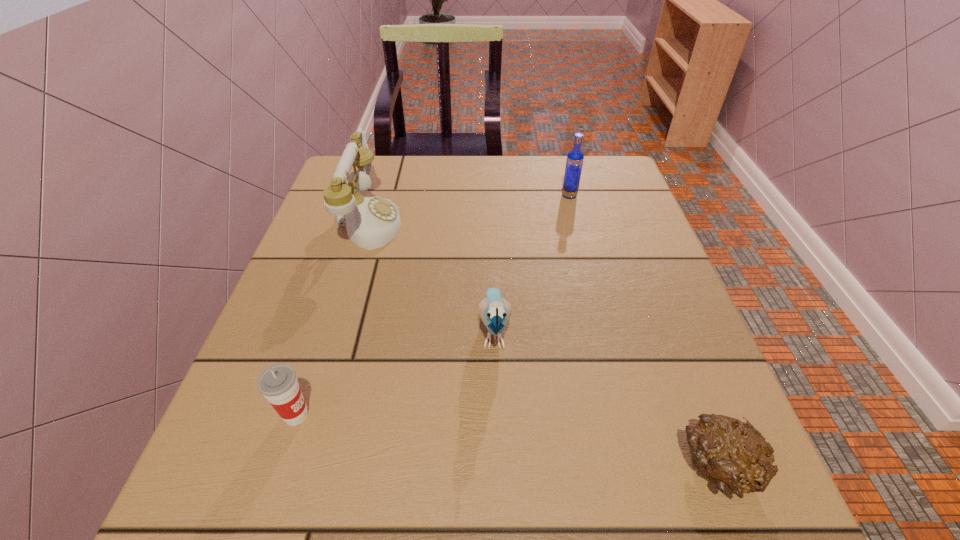
At what (x,y) coordinates should I click in order to perform the action: click on free spot that satisfies the following two spatial constraints: 1. on the side of the shortest object with the logo; 2. on the left side of the fourth farthest object. Please return your answer as a coordinate pair (x, y). The height and width of the screenshot is (540, 960). Looking at the image, I should click on (279, 468).

You are a GUI agent. You are given a task and a screenshot of the screen. Output one action in this format:
    pyautogui.click(x=<x>, y=<y>)
    Task: Click on the vacant space that satisfies the following two spatial constraints: 1. at the face of the third nearest object; 2. on the right side of the nearest object
    
    Given the screenshot: What is the action you would take?
    pyautogui.click(x=498, y=468)

This screenshot has width=960, height=540. I want to click on vacant region that satisfies the following two spatial constraints: 1. on the dial of the telephone; 2. on the left side of the rightmost object, so click(x=296, y=468).

Locate an element on the screen. vacant position in the image that satisfies the following two spatial constraints: 1. on the dial of the rightmost object; 2. on the right side of the telephone is located at coordinates (296, 468).

Identify the location of blank area in the image that satisfies the following two spatial constraints: 1. on the dial of the telephone; 2. on the back side of the nearest object. (296, 468).

You are a GUI agent. You are given a task and a screenshot of the screen. Output one action in this format:
    pyautogui.click(x=<x>, y=<y>)
    Task: Click on the free region that satisfies the following two spatial constraints: 1. at the face of the muffin; 2. on the right side of the bird
    
    Given the screenshot: What is the action you would take?
    pyautogui.click(x=498, y=468)